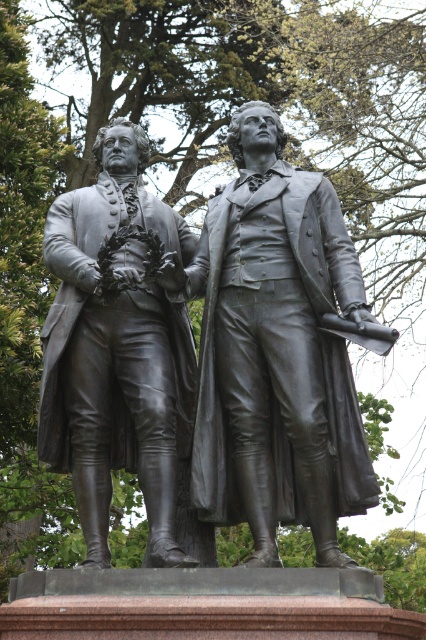
Between point (210, 451) and point (118, 465), which one is positioned in front?

Positioned in front is point (210, 451).

Is bronze statue at center positioned behind bronze statue at left?

No, bronze statue at center is in front of bronze statue at left.

Is point (250, 416) farther from viewer compared to point (149, 397)?

No, (250, 416) is in front of (149, 397).

Find the location of a particular element. The height and width of the screenshot is (640, 426). bronze statue at center is located at coordinates (276, 349).